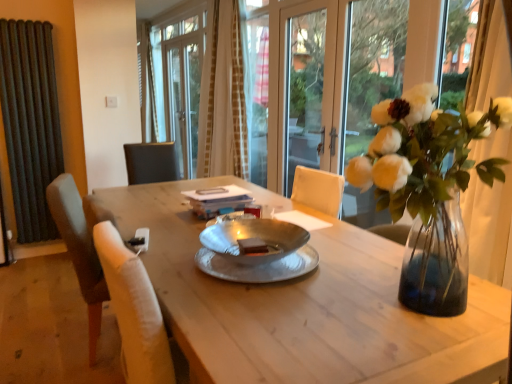
Question: Considering the relative sizes of transparent glass door at center and clear glass vase at upper right in the image provided, is transparent glass door at center thinner than clear glass vase at upper right?

Choices:
 (A) yes
 (B) no

Answer: (A)

Question: From the image's perspective, is transparent glass door at center located above clear glass vase at upper right?

Choices:
 (A) no
 (B) yes

Answer: (B)

Question: Considering the relative positions of transparent glass door at center and clear glass vase at upper right in the image provided, is transparent glass door at center to the left of clear glass vase at upper right from the viewer's perspective?

Choices:
 (A) yes
 (B) no

Answer: (A)

Question: Is transparent glass door at center to the right of clear glass vase at upper right from the viewer's perspective?

Choices:
 (A) no
 (B) yes

Answer: (A)

Question: Is clear glass vase at upper right a part of transparent glass door at center?

Choices:
 (A) yes
 (B) no

Answer: (B)

Question: Would you say dark gray radiator at left is to the left or to the right of transparent glass door at center in the picture?

Choices:
 (A) left
 (B) right

Answer: (A)

Question: Is dark gray radiator at left inside or outside of transparent glass door at center?

Choices:
 (A) outside
 (B) inside

Answer: (A)

Question: Is point (40, 114) closer or farther from the camera than point (316, 94)?

Choices:
 (A) farther
 (B) closer

Answer: (A)

Question: Is dark gray radiator at left wider or thinner than transparent glass door at center?

Choices:
 (A) thin
 (B) wide

Answer: (B)

Question: Considering the relative positions of transparent glass door at center and clear glass vase at upper right in the image provided, is transparent glass door at center to the left or to the right of clear glass vase at upper right?

Choices:
 (A) right
 (B) left

Answer: (B)

Question: Considering the positions of transparent glass door at center and clear glass vase at upper right in the image, is transparent glass door at center wider or thinner than clear glass vase at upper right?

Choices:
 (A) wide
 (B) thin

Answer: (B)

Question: In the image, is transparent glass door at center positioned in front of or behind clear glass vase at upper right?

Choices:
 (A) front
 (B) behind

Answer: (B)

Question: Is transparent glass door at center taller or shorter than clear glass vase at upper right?

Choices:
 (A) tall
 (B) short

Answer: (A)

Question: Which is correct: wooden table at center is inside beige textured curtain at upper center, or outside of it?

Choices:
 (A) inside
 (B) outside

Answer: (B)

Question: Is point (400, 362) positioned closer to the camera than point (237, 64)?

Choices:
 (A) farther
 (B) closer

Answer: (B)